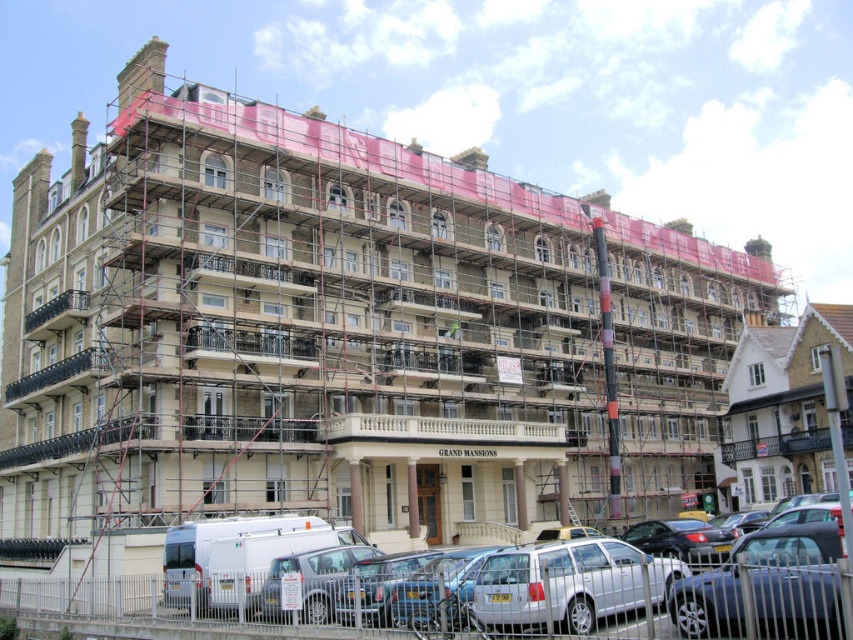
You are a delivery person driving a truck that is 2.2 meters wide. You need to park your truck between the white matte van at lower left and the metallic silver car at lower right. Can you fit your truck between them without touching either vehicle?

The distance between the white matte van at lower left and the metallic silver car at lower right is 2.19 meters. Since your truck is 2.2 meters wide, it is slightly wider than the available space. Therefore, you cannot fit your truck between them without touching either vehicle.